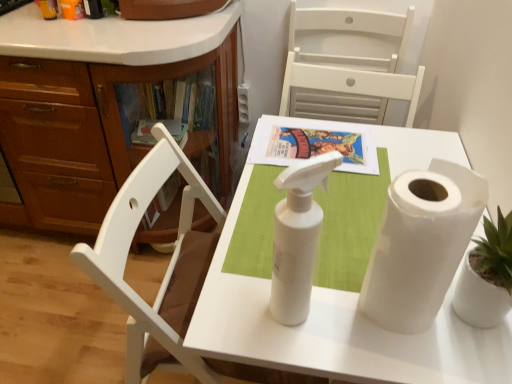
Where is `vacant space that is to the left of white matte spray bottle at center`? vacant space that is to the left of white matte spray bottle at center is located at coordinates (232, 308).